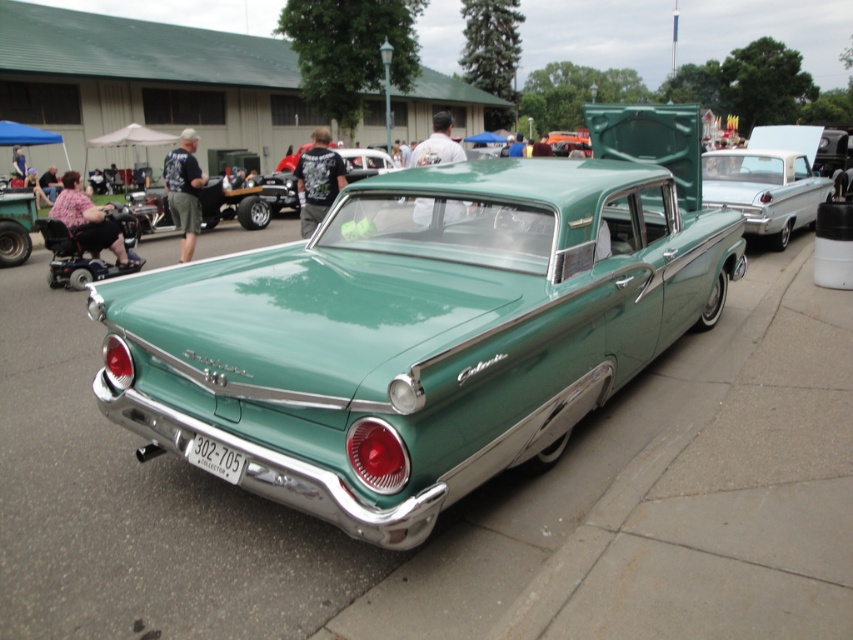
Can you confirm if green metallic sedan at center is smaller than white plastic license plate at lower center?

Actually, green metallic sedan at center might be larger than white plastic license plate at lower center.

Which is in front, point (347, 150) or point (210, 454)?

Positioned in front is point (210, 454).

Find the location of a particular element. green metallic sedan at center is located at coordinates (282, 182).

Consider the image. Between shiny silver sedan at center and white plastic license plate at lower center, which one is positioned lower?

white plastic license plate at lower center

Which is in front, point (791, 186) or point (228, 449)?

Point (228, 449) is more forward.

What are the coordinates of `shiny silver sedan at center` in the screenshot? It's located at (764, 189).

Can you confirm if shiny silver sedan at center is positioned below green metallic sedan at center?

Indeed, shiny silver sedan at center is positioned under green metallic sedan at center.

How much distance is there between shiny silver sedan at center and green metallic sedan at center?

They are 29.38 feet apart.

Who is more distant from viewer, (741, 157) or (286, 163)?

The point (286, 163) is behind.

At what (x,y) coordinates should I click in order to perform the action: click on shiny silver sedan at center. Please return your answer as a coordinate pair (x, y). Looking at the image, I should click on (764, 189).